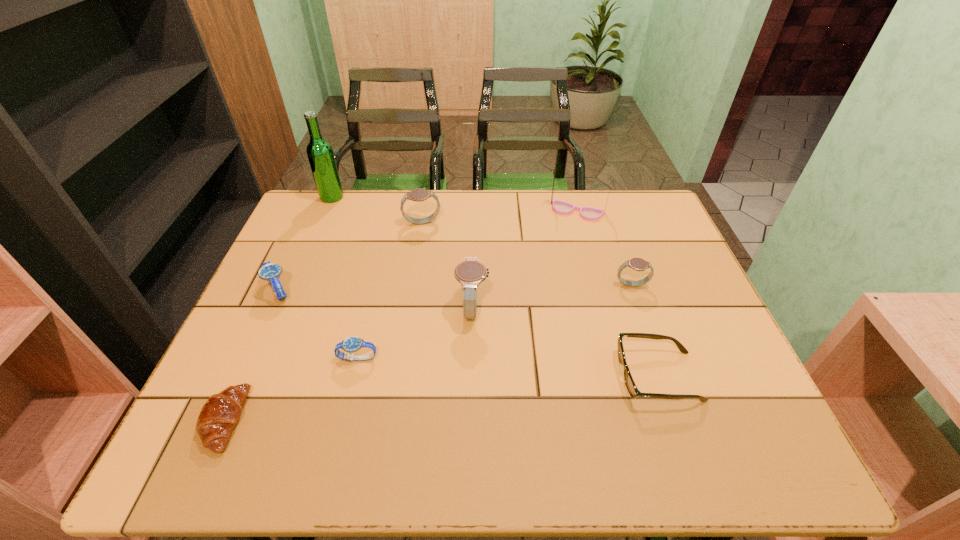
Identify the location of free space that satisfies the following two spatial constraints: 1. on the back side of the farther spectacles; 2. on the right side of the farther blue watch. (315, 211).